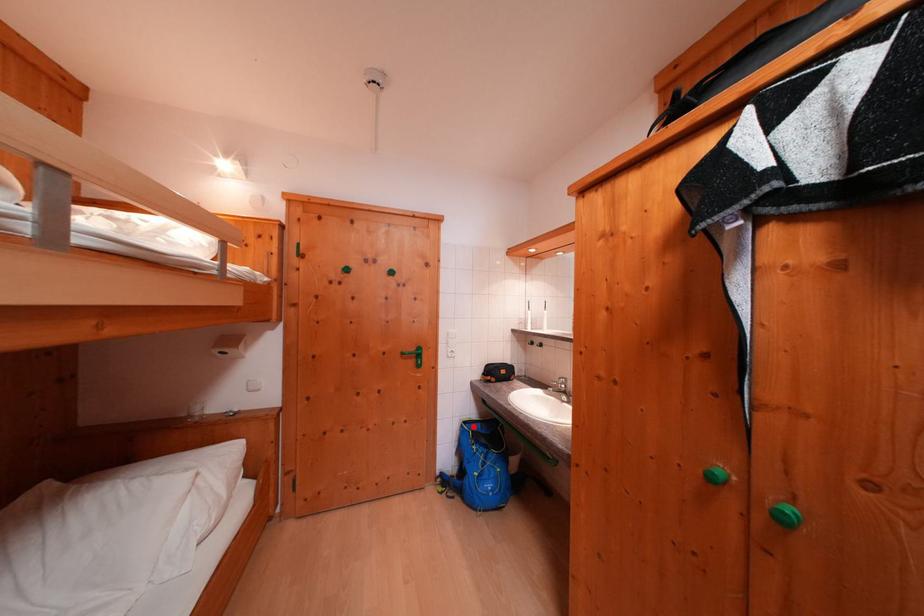
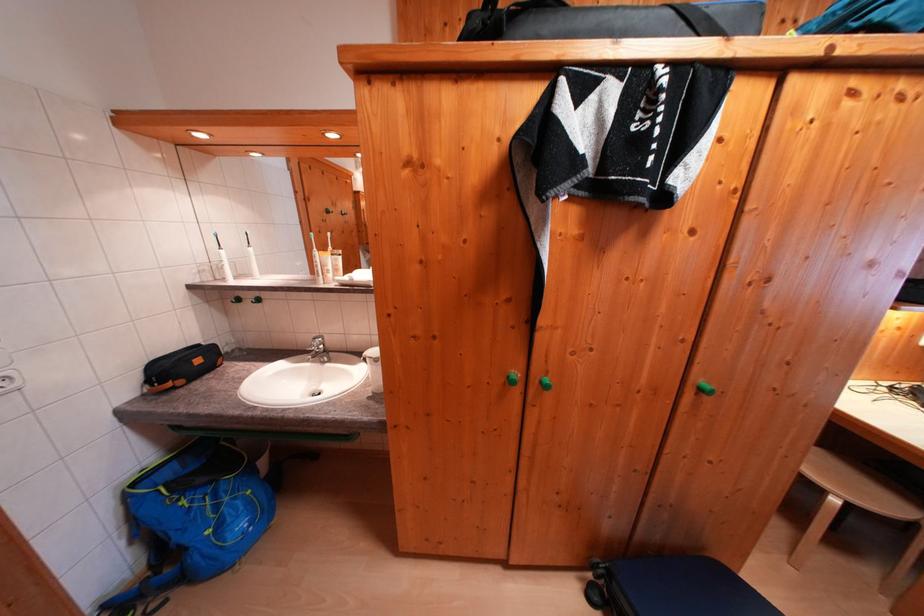
Question: I am providing you with two images of the same scene from different viewpoints. Image1 has a red point marked. In image2, the corresponding 3D location appears at what relative position? Reply with the corresponding letter.

Choices:
 (A) Closer
 (B) Farther

Answer: (A)